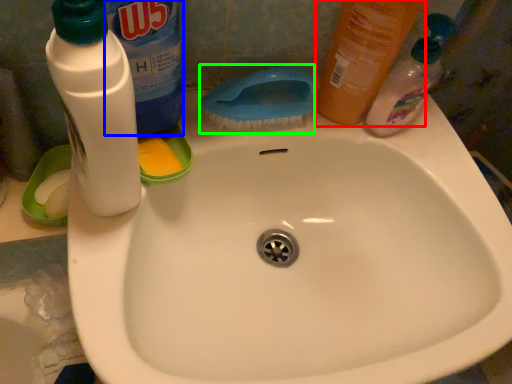
Question: Which object is positioned farthest from cleaning product (highlighted by a red box)? Select from cleaning product (highlighted by a blue box) and brush (highlighted by a green box).

Choices:
 (A) cleaning product
 (B) brush

Answer: (A)